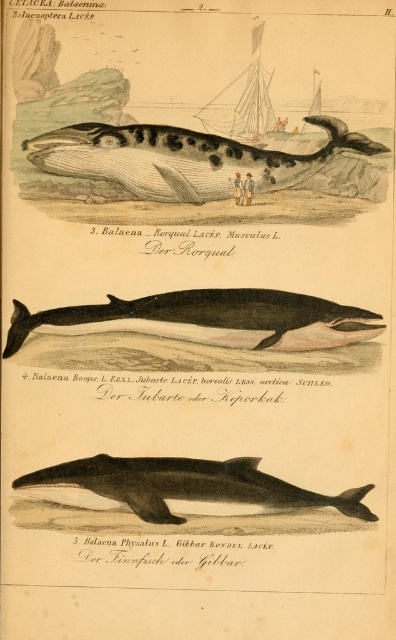
Question: Observing the image, what is the correct spatial positioning of smooth gray dolphin at center in reference to wooden sailboat at upper center?

Choices:
 (A) right
 (B) left

Answer: (B)

Question: Which point is farther to the camera?

Choices:
 (A) speckled gray whale at center
 (B) wooden sailboat at upper center
 (C) smooth gray dolphin at center

Answer: (C)

Question: Among these objects, which one is nearest to the camera?

Choices:
 (A) smooth black whale at center
 (B) speckled gray whale at center

Answer: (B)

Question: Is smooth black whale at center thinner than wooden sailboat at upper center?

Choices:
 (A) yes
 (B) no

Answer: (B)

Question: Which of the following is the closest to the observer?

Choices:
 (A) smooth gray dolphin at center
 (B) speckled gray whale at center
 (C) smooth black whale at center
 (D) wooden sailboat at upper center

Answer: (D)

Question: Is speckled gray whale at center wider than smooth black whale at center?

Choices:
 (A) no
 (B) yes

Answer: (A)